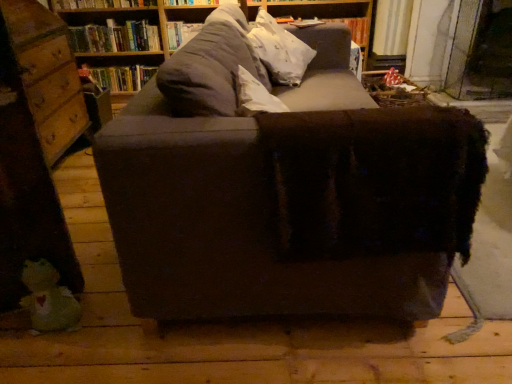
Question: Looking at the image, does hardcover book at upper center, the second book from the bottom, seem bigger or smaller compared to wooden drawer at left?

Choices:
 (A) small
 (B) big

Answer: (A)

Question: Looking at their shapes, would you say hardcover book at upper center, the second book from the bottom, is wider or thinner than wooden drawer at left?

Choices:
 (A) wide
 (B) thin

Answer: (B)

Question: Estimate the real-world distances between objects in this image. Which object is closer to the hardcover book at upper left, acting as the second book starting from the top?

Choices:
 (A) hardcover book at upper center, acting as the first book starting from the top
 (B) wooden bookshelf at upper center
 (C) dark brown fabric couch at center
 (D) white cotton throw pillow at upper center
 (E) green plush toy at lower left

Answer: (B)

Question: Considering the real-world distances, which object is closest to the hardcover book at upper center, acting as the first book starting from the top?

Choices:
 (A) green plush toy at lower left
 (B) white cotton throw pillow at upper center
 (C) wooden bookshelf at upper center
 (D) wooden drawer at left
 (E) transparent glass door at upper right

Answer: (C)